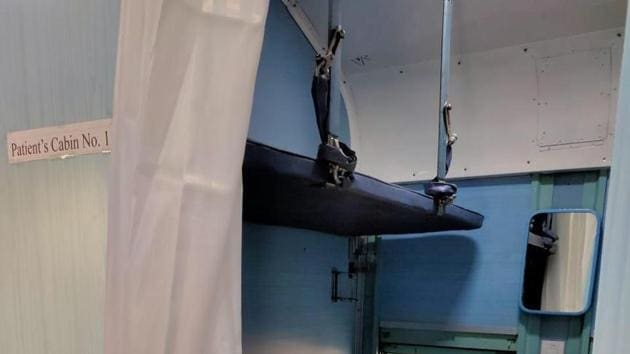
Locate an element on the screen. The image size is (630, 354). hanging blue bed straps is located at coordinates (443, 59), (333, 102).